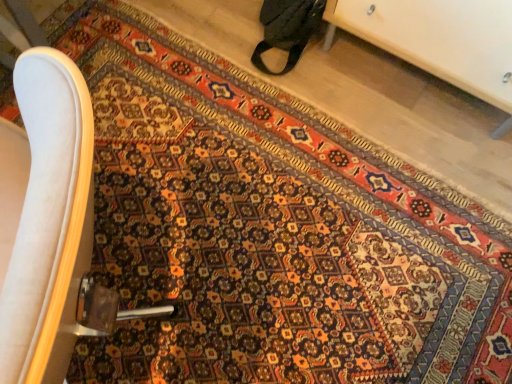
You are a GUI agent. You are given a task and a screenshot of the screen. Output one action in this format:
    pyautogui.click(x=<x>, y=<y>)
    Task: Click on the light wood cabinet at upper right
    Image resolution: width=512 pixels, height=384 pixels.
    Given the screenshot: What is the action you would take?
    pyautogui.click(x=440, y=41)

Describe the element at coordinates (440, 41) in the screenshot. I see `light wood cabinet at upper right` at that location.

You are a GUI agent. You are given a task and a screenshot of the screen. Output one action in this format:
    pyautogui.click(x=<x>, y=<y>)
    Task: Click on the light wood cabinet at upper right
    The image size is (512, 384).
    Given the screenshot: What is the action you would take?
    pyautogui.click(x=440, y=41)